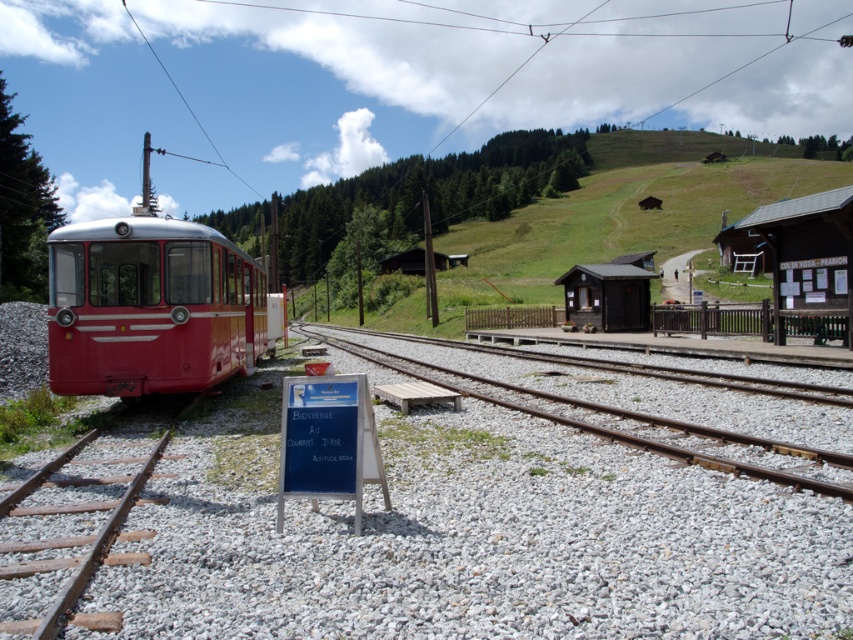
You are a railway engineer assessing the layout of the station. The red polished metal train at left needs to be moved to the right side. Given the space occupied by the brown wooden signboard at right, do you think there will be enough room to maneuver the train around the signboard?

The red polished metal train at left occupies less space than the brown wooden signboard at right, so there should be sufficient space to maneuver the train around the signboard without obstruction.

You are a maintenance worker checking the railway station. You need to access the gray gravel at center for inspection. Which direction should you move from the smooth gravel track at center to reach it?

The gray gravel at center is located below the smooth gravel track at center, so you should move downward from the smooth gravel track at center to reach the gray gravel at center.